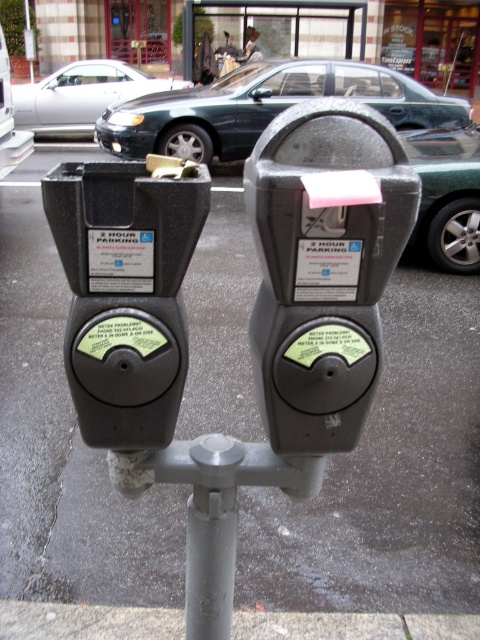
You are standing in front of the matte black parking meter at center. You want to reach into your pocket to grab a coin to put into the meter. Can you do this without moving your feet?

The distance between you and the matte black parking meter at center is 35.92 inches, which is approximately 91.2 cm. Since this distance is within a comfortable reach for most adults, you can likely reach the meter without moving your feet.

You are a delivery person approaching the gray concrete pavement at center and the matte black parking meter at center. Which object will you encounter first?

The gray concrete pavement at center is further to the viewer than the matte black parking meter at center, so you will encounter the matte black parking meter at center first.